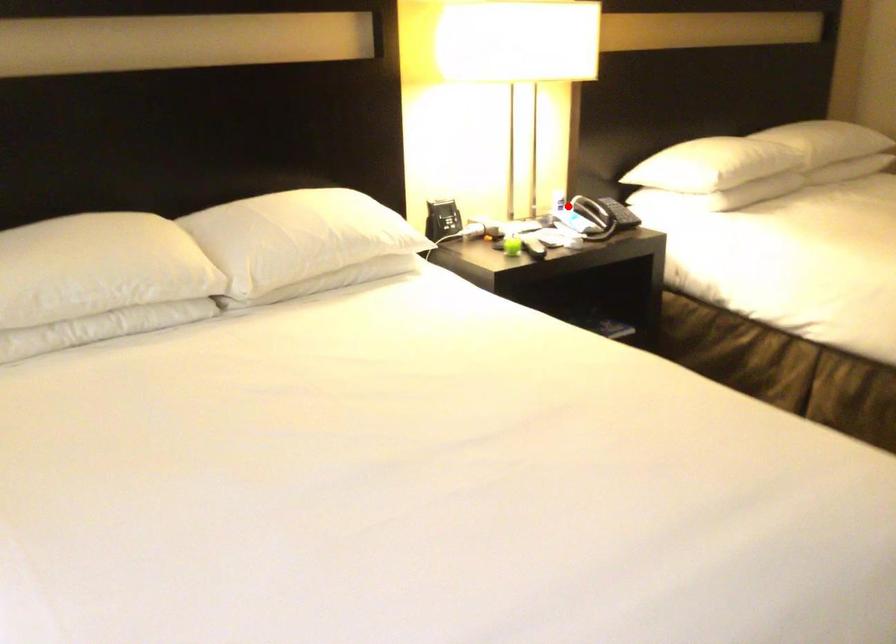
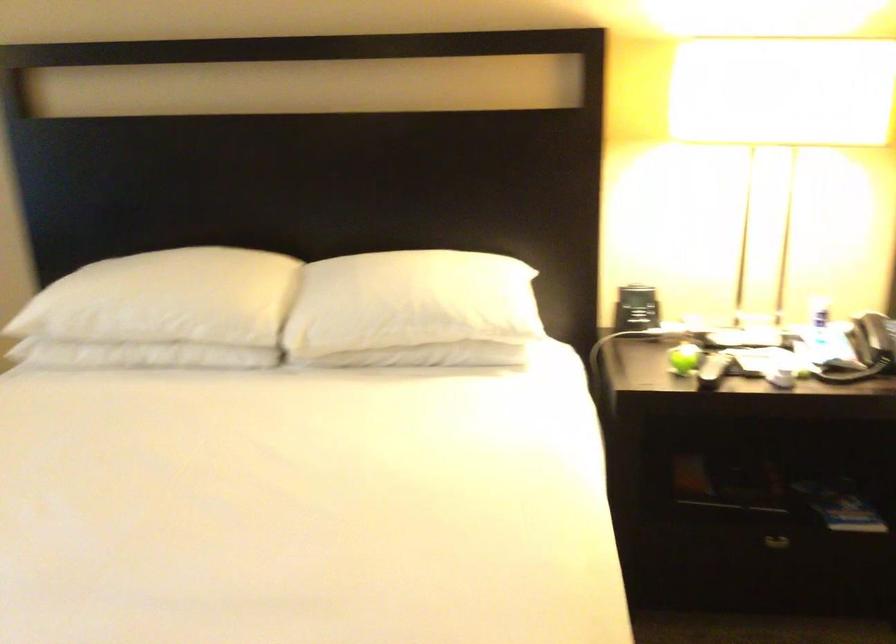
Question: I am providing you with two images of the same scene from different viewpoints. A red point is shown in image1. For the corresponding object point in image2, is it positioned nearer or farther from the camera?

Choices:
 (A) Nearer
 (B) Farther

Answer: (A)